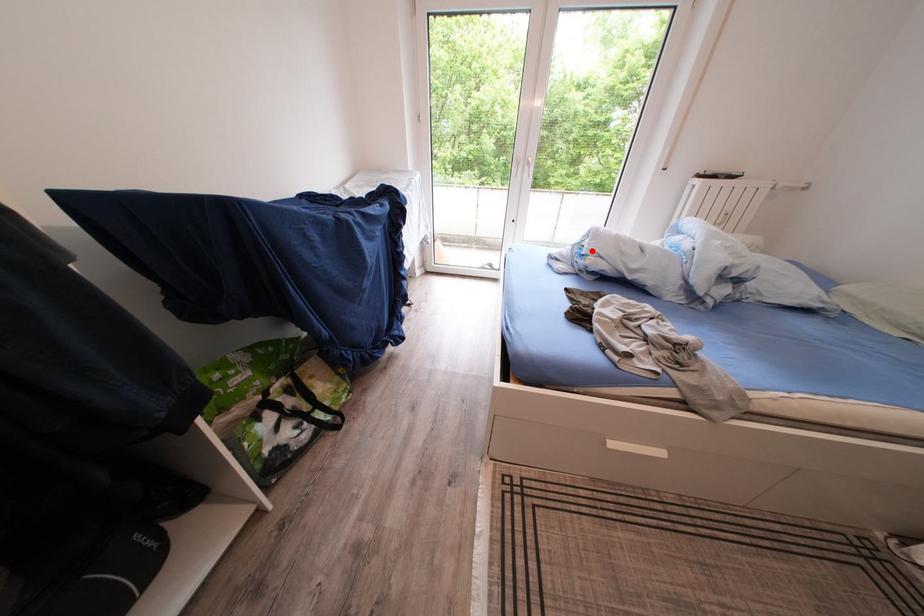
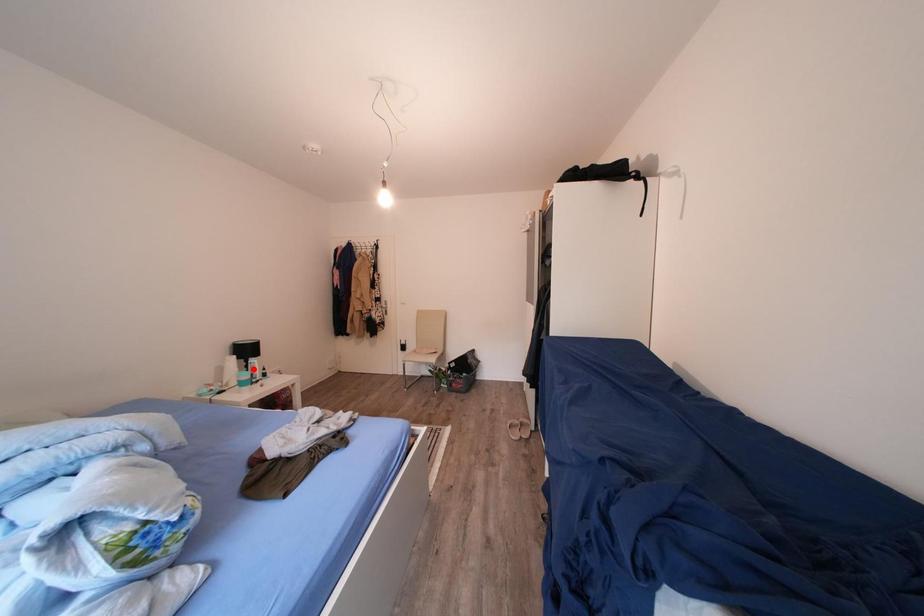
I am providing you with two images of the same scene from different viewpoints. A red point is marked on the first image and another point is marked on the second image. Are the points marked in image1 and image2 representing the same 3D position?

No